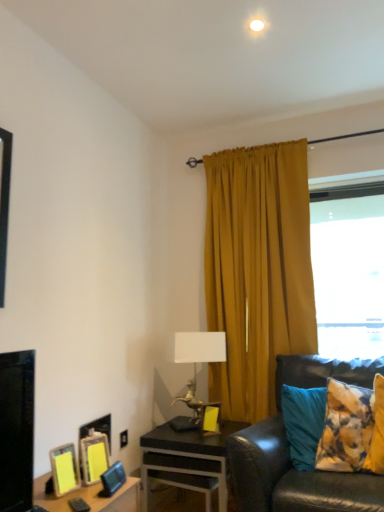
Locate an element on the screen. This screenshot has width=384, height=512. metallic horse-shaped lamp at center is located at coordinates [x=197, y=359].

The width and height of the screenshot is (384, 512). What do you see at coordinates (346, 426) in the screenshot?
I see `floral yellow pillow at right` at bounding box center [346, 426].

At what (x,y) coordinates should I click in order to perform the action: click on black leather couch at right. Please return your answer as a coordinate pair (x, y). Image resolution: width=384 pixels, height=512 pixels. Looking at the image, I should click on (289, 451).

The width and height of the screenshot is (384, 512). Describe the element at coordinates (187, 457) in the screenshot. I see `black glossy desk at lower center` at that location.

Locate an element on the screen. The image size is (384, 512). metallic horse-shaped lamp at center is located at coordinates (197, 359).

Which object is further away from the camera, mustard fabric curtain at upper right or yellow matte picture frame at lower left, which ranks as the 1th picture frame in left-to-right order?

mustard fabric curtain at upper right is further from the camera.

Is mustard fabric curtain at upper right looking in the opposite direction of yellow matte picture frame at lower left, which is the 5th picture frame from right to left?

No, mustard fabric curtain at upper right's orientation is not away from yellow matte picture frame at lower left, which is the 5th picture frame from right to left.

From the image's perspective, is mustard fabric curtain at upper right below yellow matte picture frame at lower left, the 2th picture frame from the back?

No.

At what (x,y) coordinates should I click in order to perform the action: click on curtain above the yellow matte picture frame at lower left, which ranks as the 1th picture frame in left-to-right order (from a real-world perspective). Please return your answer as a coordinate pair (x, y). Looking at the image, I should click on (257, 271).

From the image's perspective, which is below, yellow matte picture frame at lower left, which ranks as the 1th picture frame in left-to-right order, or black glossy desk at lower center?

black glossy desk at lower center is shown below in the image.

Considering the positions of points (98, 421) and (217, 453), is point (98, 421) closer to camera compared to point (217, 453)?

No, it is behind (217, 453).

Is yellow matte picture frame at lower left, placed as the 4th picture frame when sorted from front to back, not near black glossy desk at lower center?

That's not correct — yellow matte picture frame at lower left, placed as the 4th picture frame when sorted from front to back, is a little close to black glossy desk at lower center.

Locate an element on the screen. The image size is (384, 512). desk behind the yellow matte picture frame at lower left, which ranks as the 1th picture frame in left-to-right order is located at coordinates (187, 457).

Where is `lamp that is on the left side of floral yellow pillow at right`? lamp that is on the left side of floral yellow pillow at right is located at coordinates (197, 359).

Considering the positions of objects metallic horse-shaped lamp at center and floral yellow pillow at right in the image provided, who is more to the right, metallic horse-shaped lamp at center or floral yellow pillow at right?

floral yellow pillow at right is more to the right.

Is metallic horse-shaped lamp at center looking in the opposite direction of floral yellow pillow at right?

No, metallic horse-shaped lamp at center's orientation is not away from floral yellow pillow at right.

From their relative heights in the image, would you say metallic horse-shaped lamp at center is taller or shorter than floral yellow pillow at right?

In the image, metallic horse-shaped lamp at center appears to be taller than floral yellow pillow at right.

From the image's perspective, does yellow matte picture frame at lower left, marked as the third picture frame in a front-to-back arrangement, appear higher than yellow matte picture frame at lower left, placed as the 4th picture frame when sorted from front to back?

Correct, yellow matte picture frame at lower left, marked as the third picture frame in a front-to-back arrangement, appears higher than yellow matte picture frame at lower left, placed as the 4th picture frame when sorted from front to back, in the image.

Is yellow matte picture frame at lower left, acting as the third picture frame starting from the right, far from yellow matte picture frame at lower left, which ranks as the 1th picture frame in left-to-right order?

They are positioned close to each other.

Considering the sizes of objects yellow matte picture frame at lower left, which is the third picture frame in back-to-front order, and yellow matte picture frame at lower left, which is the 5th picture frame from right to left, in the image provided, who is bigger, yellow matte picture frame at lower left, which is the third picture frame in back-to-front order, or yellow matte picture frame at lower left, which is the 5th picture frame from right to left,?

yellow matte picture frame at lower left, which is the third picture frame in back-to-front order.

Considering the points (103, 442) and (177, 468), which point is in front, point (103, 442) or point (177, 468)?

The point (103, 442) is in front.

How much distance is there between yellow matte picture frame at lower left, the third picture frame from the left, and black glossy desk at lower center?

yellow matte picture frame at lower left, the third picture frame from the left, and black glossy desk at lower center are 24.93 inches apart from each other.

Is yellow matte picture frame at lower left, marked as the third picture frame in a front-to-back arrangement, in front of or behind black glossy desk at lower center in the image?

yellow matte picture frame at lower left, marked as the third picture frame in a front-to-back arrangement, is in front of black glossy desk at lower center.

Based on the photo, from the image's perspective, is yellow matte picture frame at lower left, the third picture frame from the left, located above or below black glossy desk at lower center?

yellow matte picture frame at lower left, the third picture frame from the left, is above black glossy desk at lower center.

From the image's perspective, is mustard fabric curtain at upper right below black glossy desk at lower center?

No.

Where is `desk that is in front of the mustard fabric curtain at upper right`? The height and width of the screenshot is (512, 384). desk that is in front of the mustard fabric curtain at upper right is located at coordinates (187, 457).

Is mustard fabric curtain at upper right outside of black glossy desk at lower center?

Yes, mustard fabric curtain at upper right is located beyond the bounds of black glossy desk at lower center.

Looking at their sizes, would you say mustard fabric curtain at upper right is wider or thinner than black glossy desk at lower center?

Clearly, mustard fabric curtain at upper right has less width compared to black glossy desk at lower center.

Is point (121, 479) positioned after point (214, 324)?

No, (121, 479) is closer to viewer.

You are a GUI agent. You are given a task and a screenshot of the screen. Output one action in this format:
    pyautogui.click(x=<x>, y=<y>)
    Task: Click on the 5th picture frame in front of the mustard fabric curtain at upper right
    
    Given the screenshot: What is the action you would take?
    pyautogui.click(x=112, y=479)

Can you confirm if matte yellow picture frame at lower left, which is the fourth picture frame in left-to-right order, is smaller than mustard fabric curtain at upper right?

Yes, matte yellow picture frame at lower left, which is the fourth picture frame in left-to-right order, is smaller than mustard fabric curtain at upper right.

From the image's perspective, which one is positioned higher, matte yellow picture frame at lower left, which is the fourth picture frame in left-to-right order, or mustard fabric curtain at upper right?

mustard fabric curtain at upper right, from the image's perspective.

From a real-world perspective, count 5th picture frames downward from the mustard fabric curtain at upper right and point to it. Please provide its 2D coordinates.

[(98, 428)]

From the black glossy desk at lower center, count 1st picture frames forward and point to it. Please provide its 2D coordinates.

[(98, 428)]

Based on the photo, looking at the image, which one is located further to transparent glass window at upper right, yellow matte picture frame at lower left, the third picture frame from the left, or yellow matte picture frame at center, which appears as the 5th picture frame when viewed from the front?

yellow matte picture frame at lower left, the third picture frame from the left.

Looking at the image, which one is located further to mustard fabric curtain at upper right, floral yellow pillow at right or matte yellow picture frame at lower left, the 1th picture frame from the front?

The object further to mustard fabric curtain at upper right is matte yellow picture frame at lower left, the 1th picture frame from the front.

Which object lies further to the anchor point metallic horse-shaped lamp at center, yellow matte picture frame at lower left, the 2th picture frame from the back, or yellow matte picture frame at lower left, which is the third picture frame in back-to-front order?

The object further to metallic horse-shaped lamp at center is yellow matte picture frame at lower left, which is the third picture frame in back-to-front order.

When comparing their distances from yellow paper at lower left, arranged as the 4th picture frame when viewed from the back, does metallic horse-shaped lamp at center or yellow matte picture frame at lower left, placed as the 4th picture frame when sorted from front to back, seem closer?

yellow matte picture frame at lower left, placed as the 4th picture frame when sorted from front to back, lies closer to yellow paper at lower left, arranged as the 4th picture frame when viewed from the back, than the other object.

Based on their spatial positions, is yellow matte picture frame at lower left, placed as the 4th picture frame when sorted from front to back, or mustard fabric curtain at upper right closer to black leather couch at right?

mustard fabric curtain at upper right.

Considering their positions, is yellow paper at lower left, arranged as the 4th picture frame when viewed from the back, positioned further to matte yellow picture frame at lower left, the 1th picture frame from the front, than black glossy desk at lower center?

black glossy desk at lower center is further to matte yellow picture frame at lower left, the 1th picture frame from the front.

Considering their positions, is yellow matte picture frame at lower left, the third picture frame from the left, positioned closer to yellow matte picture frame at lower left, the 2th picture frame from the back, than transparent glass window at upper right?

yellow matte picture frame at lower left, the third picture frame from the left, is positioned closer to the anchor yellow matte picture frame at lower left, the 2th picture frame from the back.

When comparing their distances from transparent glass window at upper right, does metallic horse-shaped lamp at center or yellow paper at lower left, which is the second picture frame from left to right, seem closer?

metallic horse-shaped lamp at center lies closer to transparent glass window at upper right than the other object.

At what (x,y) coordinates should I click in order to perform the action: click on picture frame situated between black glossy desk at lower center and floral yellow pillow at right from left to right. Please return your answer as a coordinate pair (x, y). This screenshot has width=384, height=512. Looking at the image, I should click on (211, 419).

Where is `studio couch between yellow paper at lower left, arranged as the 4th picture frame when viewed from the back, and transparent glass window at upper right from left to right`? The image size is (384, 512). studio couch between yellow paper at lower left, arranged as the 4th picture frame when viewed from the back, and transparent glass window at upper right from left to right is located at coordinates 289,451.

I want to click on desk between yellow matte picture frame at lower left, placed as the 4th picture frame when sorted from front to back, and transparent glass window at upper right, so click(x=187, y=457).

Find the location of a particular element. curtain that lies between transparent glass window at upper right and black glossy desk at lower center from top to bottom is located at coordinates (257, 271).